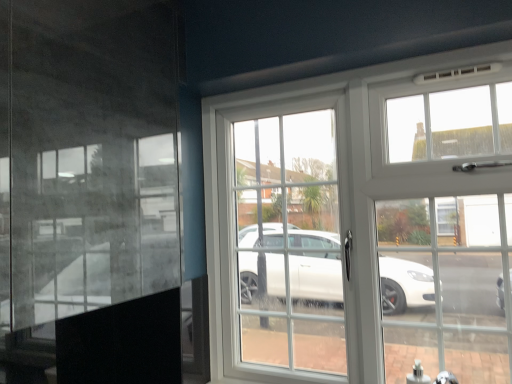
Image resolution: width=512 pixels, height=384 pixels. I want to click on empty space that is ontop of white plastic window at center, so click(x=337, y=72).